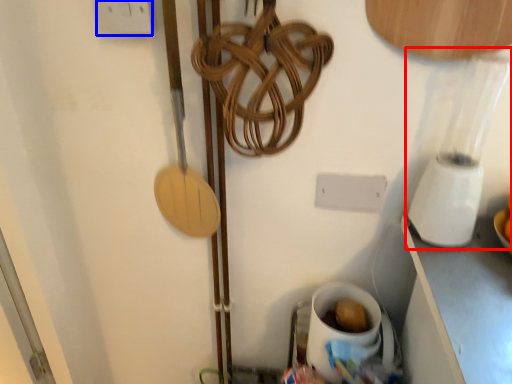
Question: Which object appears farthest to the camera in this image, blender (highlighted by a red box) or electric outlet (highlighted by a blue box)?

Choices:
 (A) blender
 (B) electric outlet

Answer: (B)